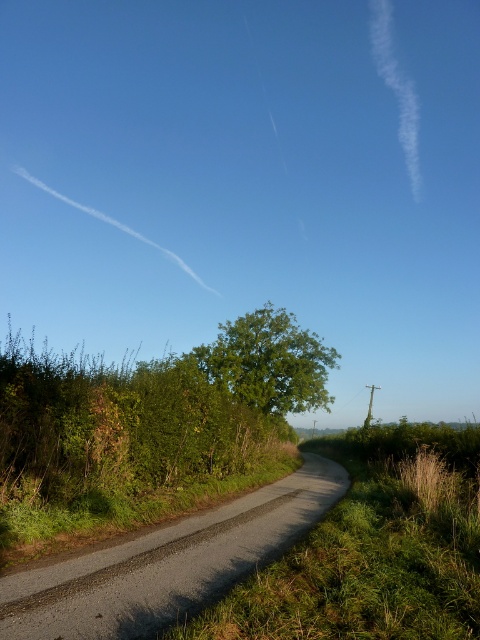
Question: Which object appears farthest from the camera in this image?

Choices:
 (A) gravel road at center
 (B) green leafy tree at center

Answer: (B)

Question: Is gravel road at center thinner than green leafy tree at center?

Choices:
 (A) no
 (B) yes

Answer: (B)

Question: Can you confirm if gravel road at center is smaller than green leafy tree at center?

Choices:
 (A) no
 (B) yes

Answer: (B)

Question: Which point is closer to the camera?

Choices:
 (A) gravel road at center
 (B) green leafy tree at center

Answer: (A)

Question: Where is gravel road at center located in relation to green leafy tree at center in the image?

Choices:
 (A) above
 (B) below

Answer: (B)